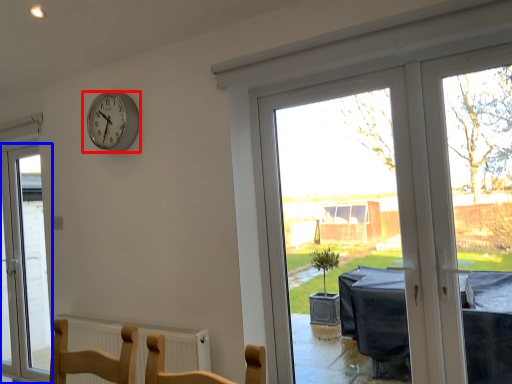
Question: Among these objects, which one is nearest to the camera, wall clock (highlighted by a red box) or window (highlighted by a blue box)?

Choices:
 (A) wall clock
 (B) window

Answer: (A)